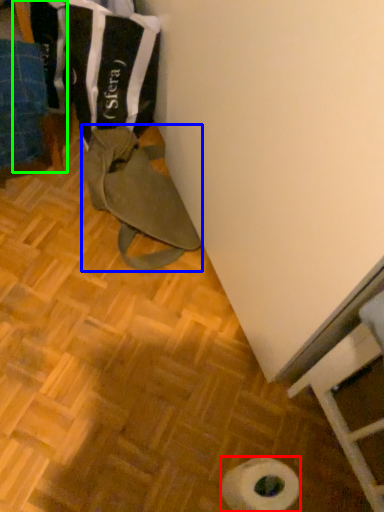
Question: Based on their relative distances, which object is nearer to toilet paper (highlighted by a red box)? Choose from wide (highlighted by a blue box) and wood (highlighted by a green box).

Choices:
 (A) wide
 (B) wood

Answer: (A)